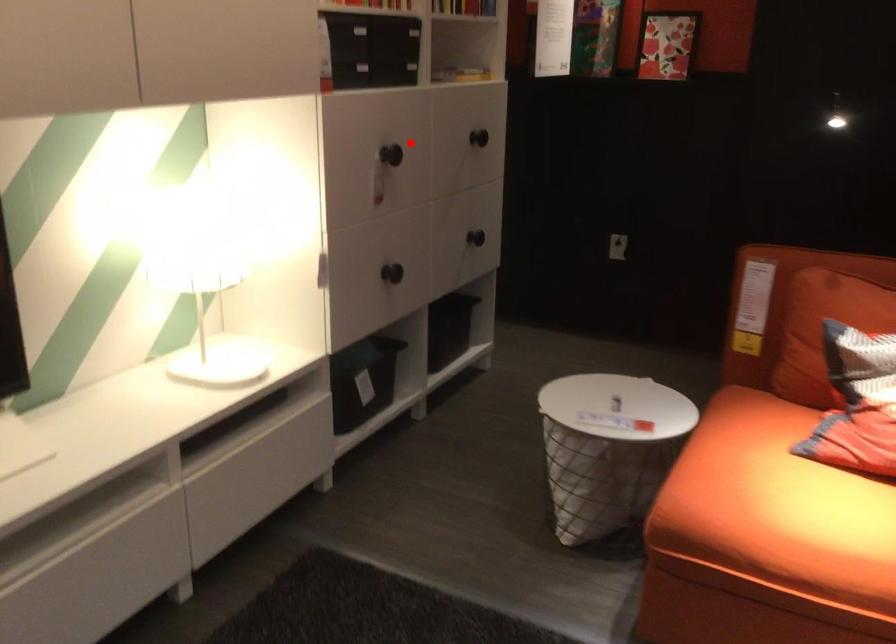
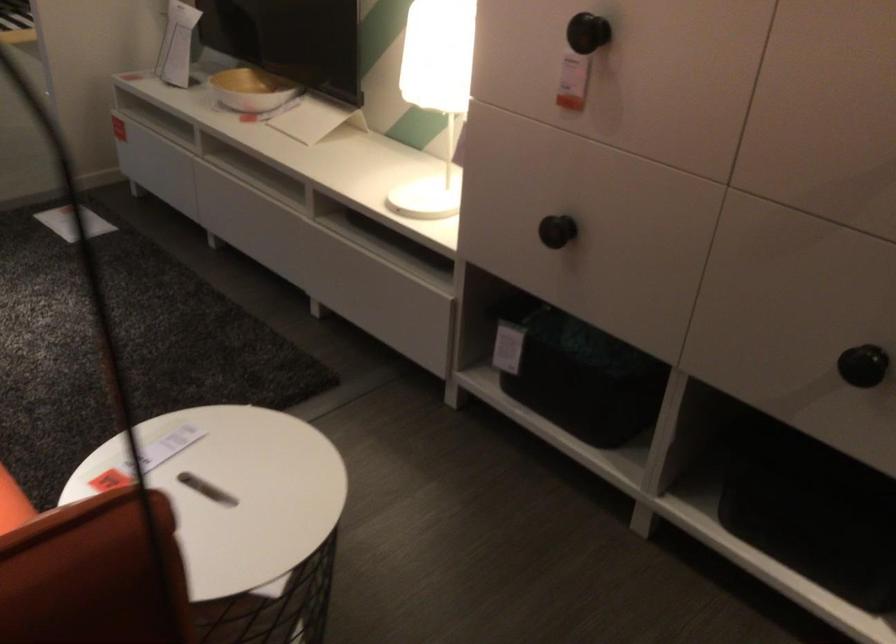
Question: I am providing you with two images of the same scene from different viewpoints. In image1, a red point is highlighted. Considering the same 3D point in image2, which of the following is correct?

Choices:
 (A) It is closer
 (B) It is farther

Answer: (A)